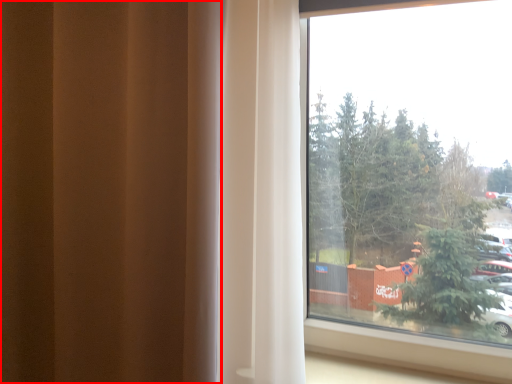
Question: From the image's perspective, what is the correct spatial positioning of curtain (annotated by the red box) in reference to window?

Choices:
 (A) above
 (B) below

Answer: (B)